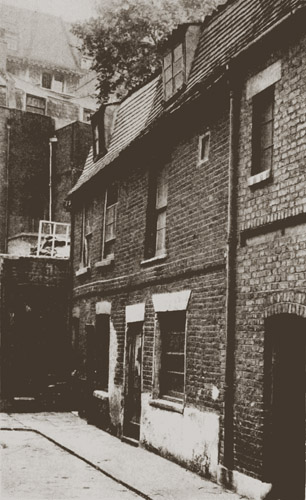
Where is `the top floor window`? The image size is (306, 500). the top floor window is located at coordinates (90, 222), (111, 208), (159, 240), (263, 143).